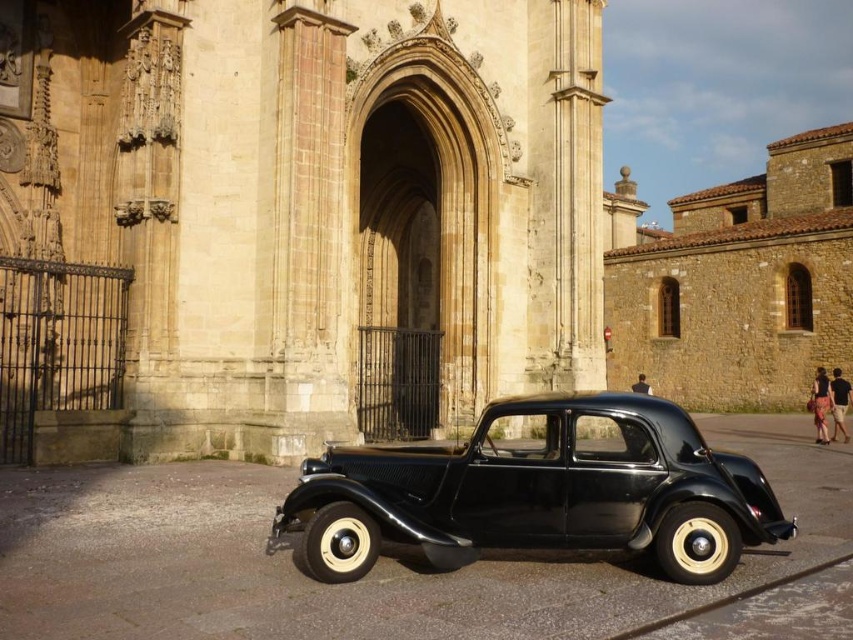
Question: Which object is positioned closest to the beige stone church at center?

Choices:
 (A) shiny black car at center
 (B) brown stone church at right

Answer: (A)

Question: Is beige stone church at center thinner than brown stone church at right?

Choices:
 (A) no
 (B) yes

Answer: (B)

Question: Can you confirm if beige stone church at center is thinner than brown stone church at right?

Choices:
 (A) no
 (B) yes

Answer: (B)

Question: Among these points, which one is nearest to the camera?

Choices:
 (A) (732, 243)
 (B) (601, 483)
 (C) (125, 154)

Answer: (B)

Question: Does shiny black car at center appear on the right side of brown stone church at right?

Choices:
 (A) no
 (B) yes

Answer: (A)

Question: Which object is positioned farthest from the shiny black car at center?

Choices:
 (A) beige stone church at center
 (B) brown stone church at right

Answer: (B)